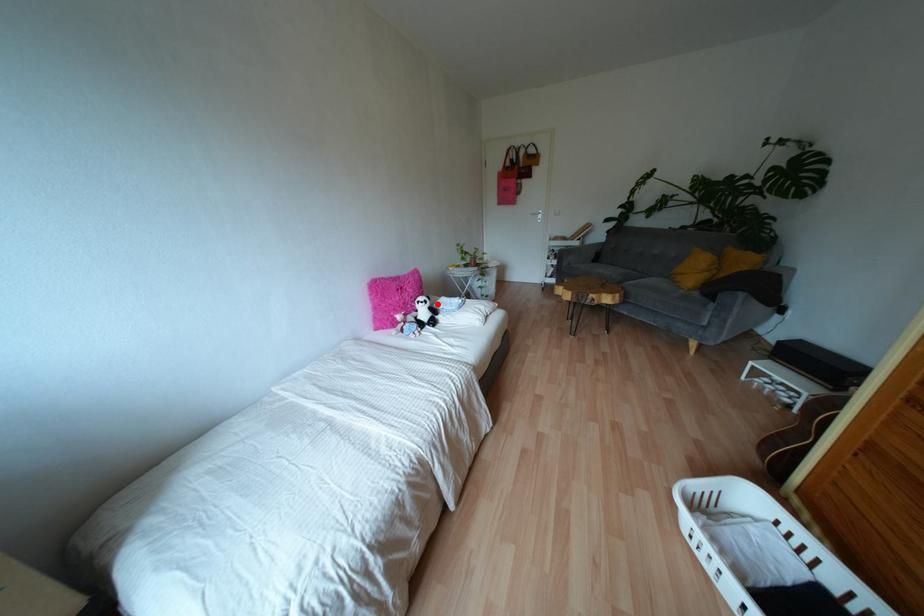
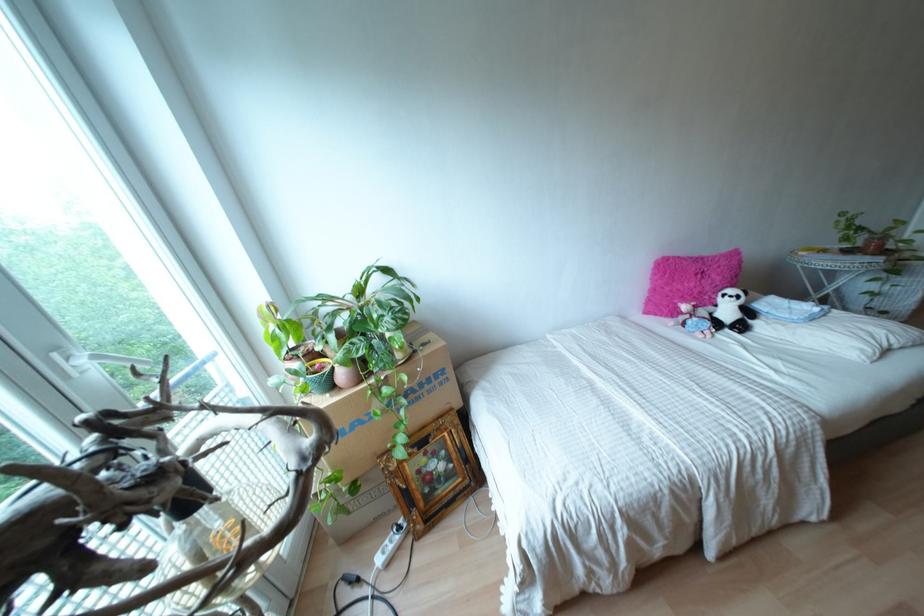
Where in the second image is the point corresponding to the highlighted location from the first image?

(759, 305)